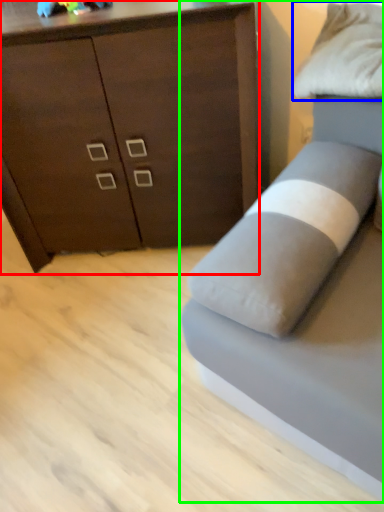
Question: Which is nearer to the chest of drawers (highlighted by a red box)? pillow (highlighted by a blue box) or studio couch (highlighted by a green box).

Choices:
 (A) pillow
 (B) studio couch

Answer: (A)